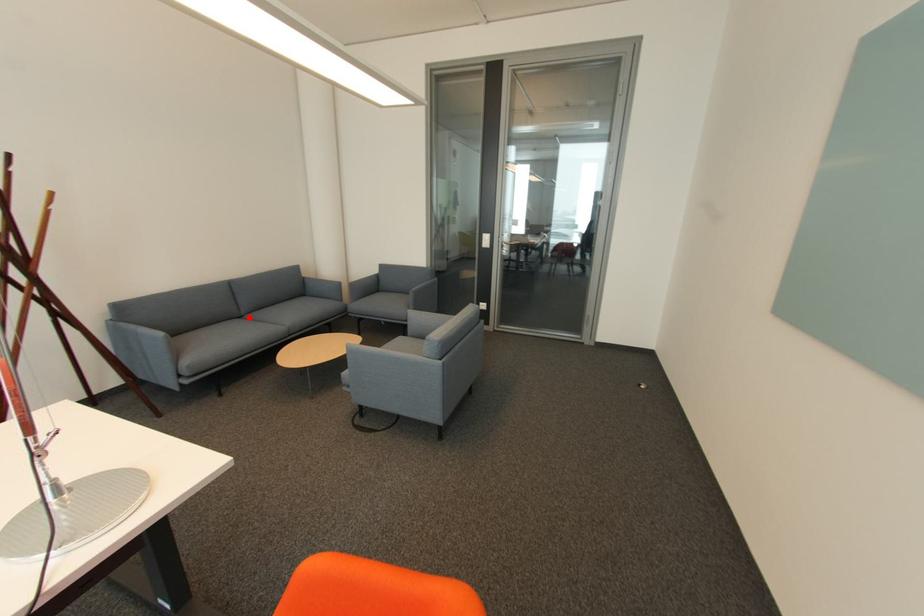
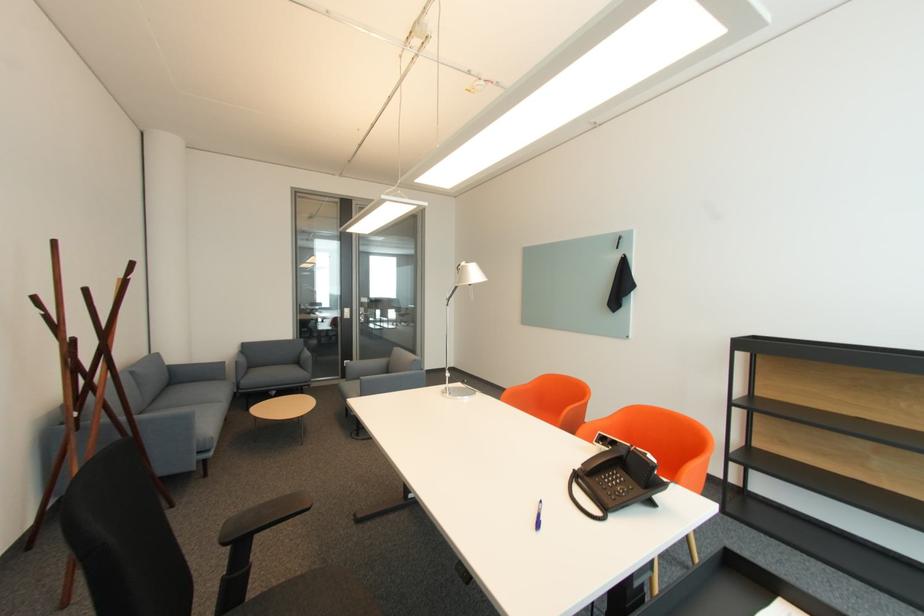
Question: I am providing you with two images of the same scene from different viewpoints. Image1 has a red point marked. In image2, the corresponding 3D location appears at what relative position? Reply with the corresponding letter.

Choices:
 (A) Closer
 (B) Farther

Answer: (B)